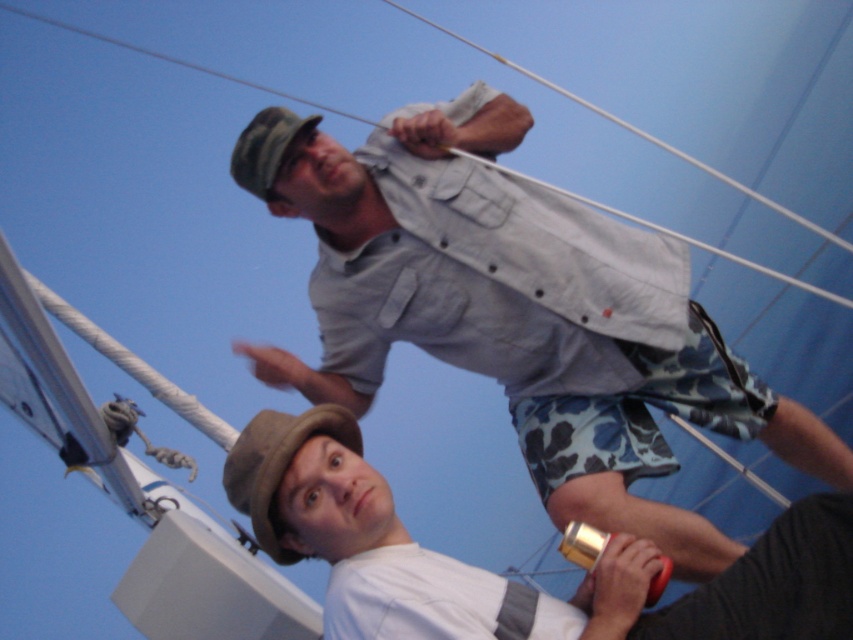
Question: Does brown felt hat at lower center have a greater width compared to camouflage fabric hat at upper center?

Choices:
 (A) no
 (B) yes

Answer: (B)

Question: Which point is closer to the camera taking this photo?

Choices:
 (A) (305, 131)
 (B) (279, 448)

Answer: (B)

Question: Is white matte hat at lower center to the right of brown felt hat at lower center from the viewer's perspective?

Choices:
 (A) no
 (B) yes

Answer: (B)

Question: Which point is closer to the camera taking this photo?

Choices:
 (A) (413, 330)
 (B) (277, 483)
 (C) (306, 461)

Answer: (B)

Question: Which object is closer to the camera taking this photo?

Choices:
 (A) camouflage fabric hat at upper center
 (B) brown felt hat at lower center
 (C) light gray fabric shirt at upper center

Answer: (B)

Question: Is light gray fabric shirt at upper center thinner than brown felt hat at lower center?

Choices:
 (A) yes
 (B) no

Answer: (B)